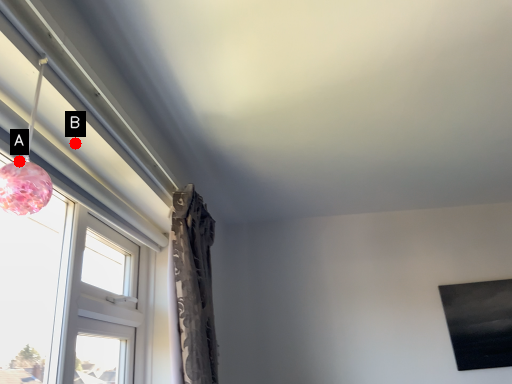
Question: Two points are circled on the image, labeled by A and B beside each circle. Which point is farther from the camera taking this photo?

Choices:
 (A) A is further
 (B) B is further

Answer: (B)